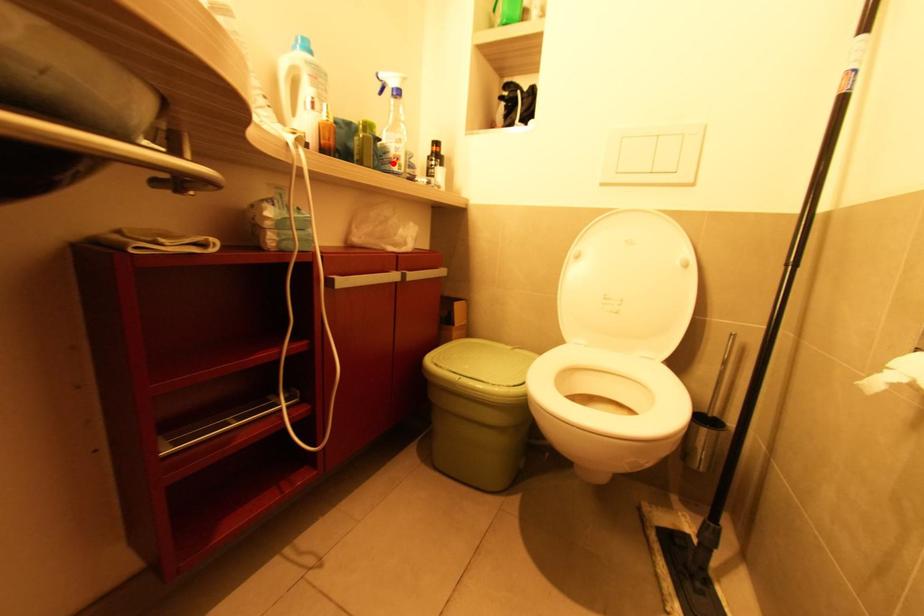
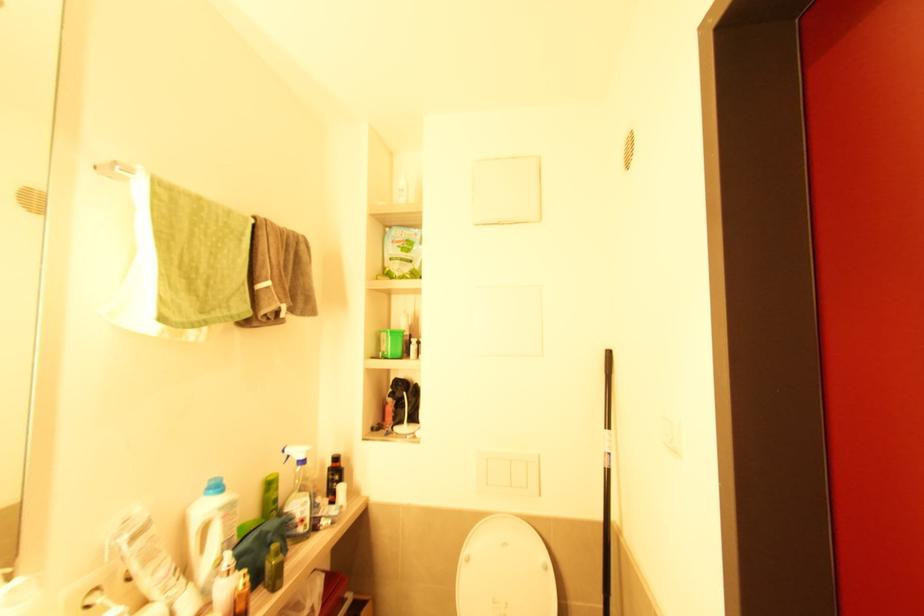
In the second image, find the point that corresponds to the highlighted location in the first image.

(298, 527)